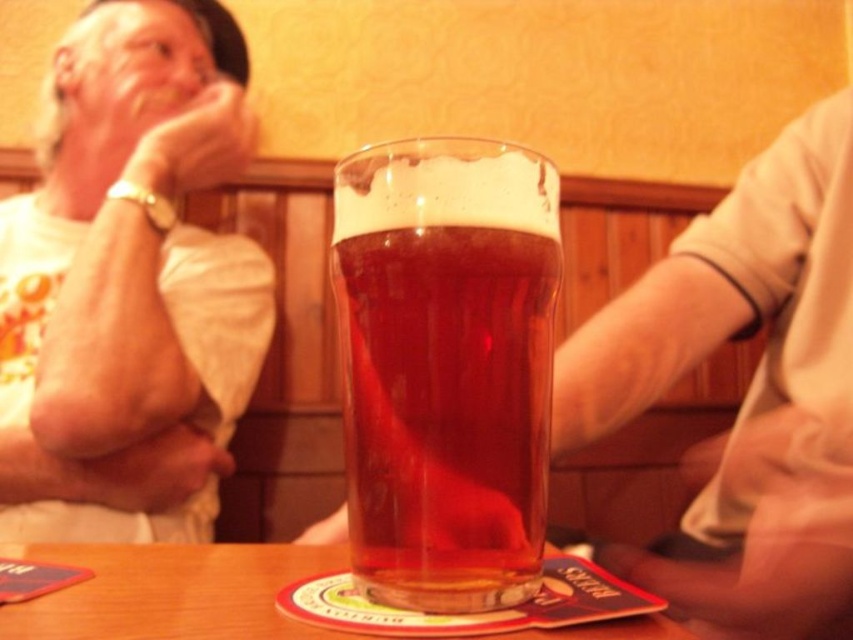
Measure the distance between point (115, 516) and camera.

Point (115, 516) and camera are 34.66 inches apart.

Which is in front, point (0, 205) or point (515, 166)?

Point (515, 166) is more forward.

The width and height of the screenshot is (853, 640). Identify the location of white cotton shirt at upper left. (126, 288).

Can you confirm if white cotton shirt at upper left is positioned above wooden table at center?

Yes.

Which is in front, point (154, 48) or point (91, 586)?

Point (91, 586)

This screenshot has width=853, height=640. What are the coordinates of `white cotton shirt at upper left` in the screenshot? It's located at (126, 288).

Where is `white cotton shirt at upper left`? This screenshot has height=640, width=853. white cotton shirt at upper left is located at coordinates coord(126,288).

Does translucent glass beer at center have a greater width compared to wooden table at center?

No.

Is translucent glass beer at center to the right of wooden table at center from the viewer's perspective?

Correct, you'll find translucent glass beer at center to the right of wooden table at center.

Locate an element on the screen. Image resolution: width=853 pixels, height=640 pixels. translucent glass beer at center is located at coordinates (445, 365).

I want to click on translucent glass beer at center, so click(x=445, y=365).